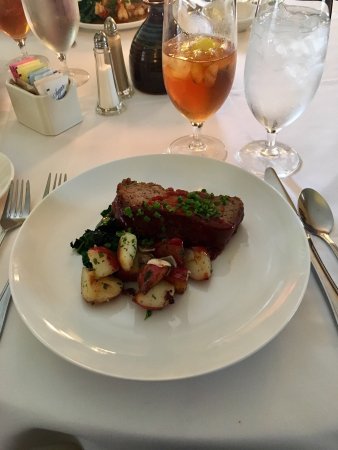
Identify the location of spoon. (315, 205).